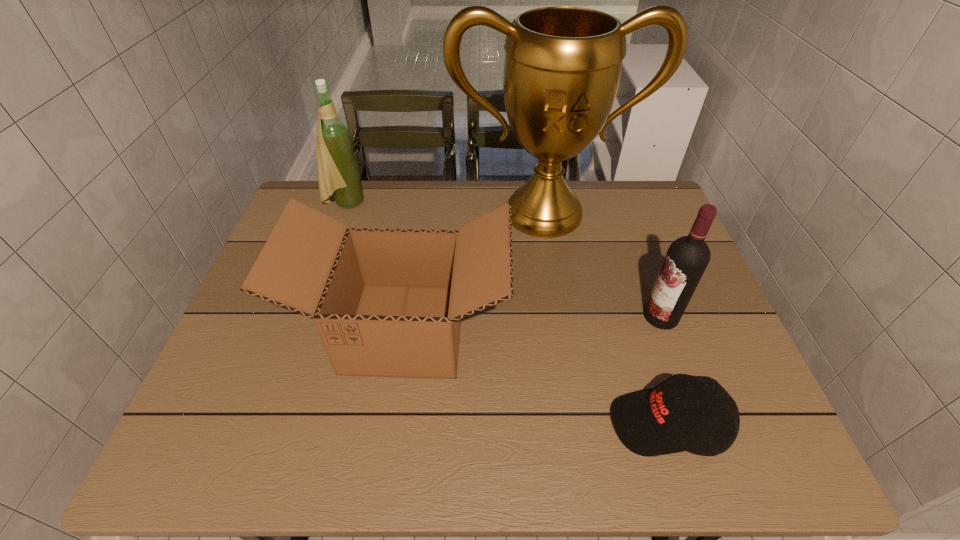
Find the location of a particular element. The image size is (960, 540). free spot between the nearest object and the second shortest object is located at coordinates (537, 376).

You are a GUI agent. You are given a task and a screenshot of the screen. Output one action in this format:
    pyautogui.click(x=<x>, y=<y>)
    Task: Click on the object that is the fourth closest to the third shortest object
    Image resolution: width=960 pixels, height=540 pixels.
    Given the screenshot: What is the action you would take?
    pyautogui.click(x=338, y=175)

Identify which object is the closest to the trophy cup. Please provide its 2D coordinates. Your answer should be formatted as a tuple, i.e. [(x, y)], where the tuple contains the x and y coordinates of a point satisfying the conditions above.

[(386, 302)]